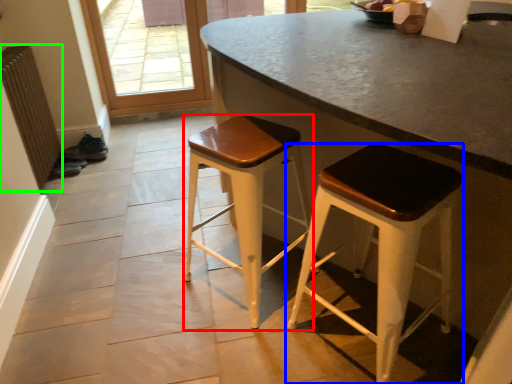
Question: Estimate the real-world distances between objects in this image. Which object is farther from stool (highlighted by a red box), stool (highlighted by a blue box) or radiator (highlighted by a green box)?

Choices:
 (A) stool
 (B) radiator

Answer: (B)